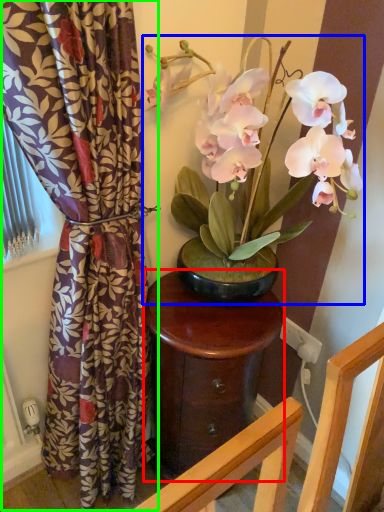
Question: Which object is positioned closest to table (highlighted by a red box)? Select from houseplant (highlighted by a blue box) and curtain (highlighted by a green box).

Choices:
 (A) houseplant
 (B) curtain

Answer: (B)